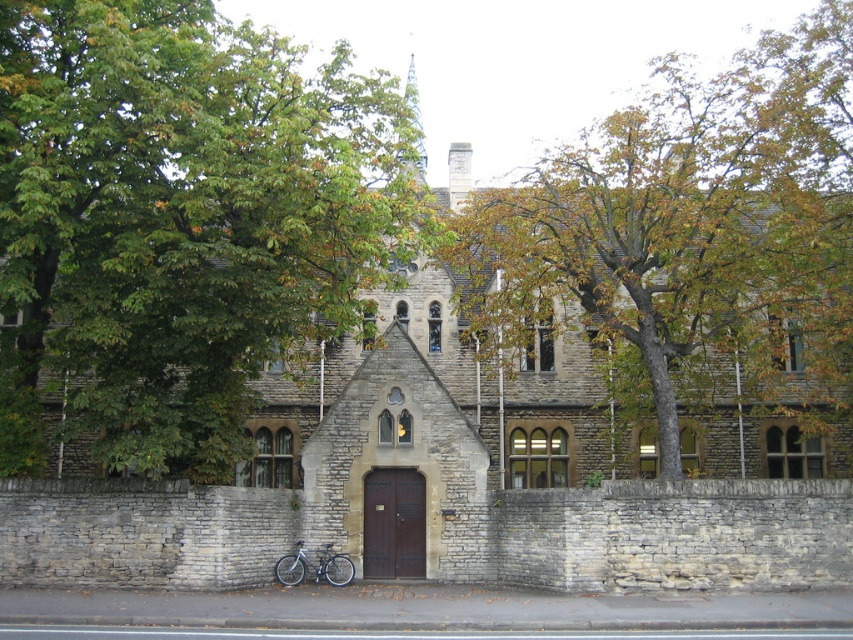
Between point (85, 232) and point (753, 76), which one is positioned behind?

Point (753, 76)

Is green leafy tree at upper left closer to the viewer compared to green leafy tree at upper center?

Yes.

Is point (64, 374) positioned before point (793, 314)?

That is False.

This screenshot has width=853, height=640. What are the coordinates of `green leafy tree at upper left` in the screenshot? It's located at (180, 220).

Can you confirm if stone church at center is taller than silver metallic bicycle at lower center?

Yes, stone church at center is taller than silver metallic bicycle at lower center.

Does point (490, 518) come in front of point (328, 561)?

No, it is behind (328, 561).

What do you see at coordinates (428, 513) in the screenshot? I see `stone church at center` at bounding box center [428, 513].

This screenshot has width=853, height=640. Identify the location of stone church at center. (428, 513).

What do you see at coordinates (693, 234) in the screenshot? I see `green leafy tree at upper center` at bounding box center [693, 234].

Looking at this image, between green leafy tree at upper center and stone church at center, which one has less height?

With less height is stone church at center.

Is point (683, 252) closer to camera compared to point (222, 541)?

No, (683, 252) is behind (222, 541).

Identify the location of green leafy tree at upper center. The width and height of the screenshot is (853, 640). (693, 234).